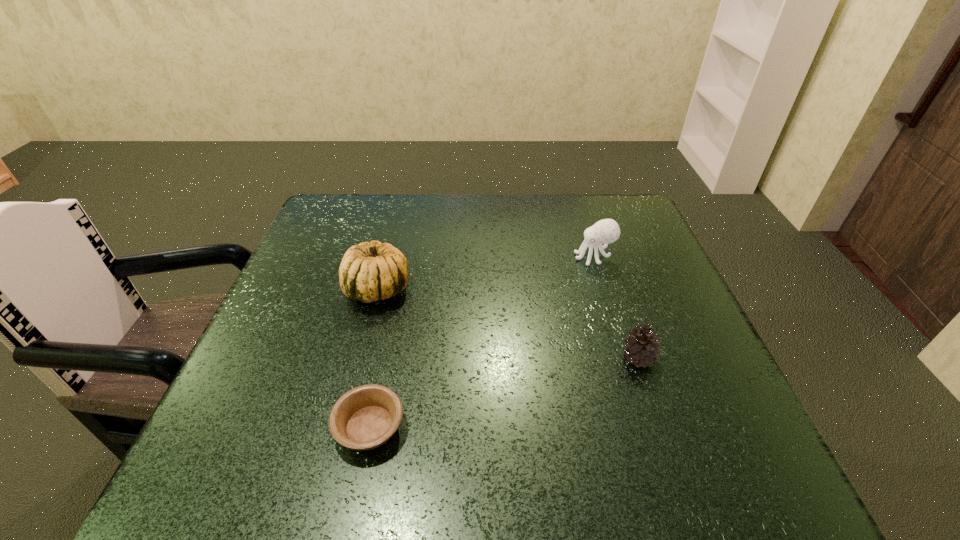
The height and width of the screenshot is (540, 960). In order to click on vacant space located 0.180m on the left of the second nearest object in this screenshot , I will do `click(530, 357)`.

Locate an element on the screen. Image resolution: width=960 pixels, height=540 pixels. vacant space located 0.200m on the back of the shortest object is located at coordinates (393, 318).

Identify the location of object that is at the near edge. The height and width of the screenshot is (540, 960). (365, 417).

I want to click on object present at the left edge, so click(x=369, y=272).

The height and width of the screenshot is (540, 960). Identify the location of octopus present at the right edge. (606, 231).

The image size is (960, 540). In order to click on pinecone situated at the right edge in this screenshot , I will do `click(643, 348)`.

Where is `vacant space at the far edge`? This screenshot has height=540, width=960. vacant space at the far edge is located at coordinates [x=400, y=197].

In the image, there is a desktop. At what (x,y) coordinates should I click in order to perform the action: click on vacant space at the near edge. Please return your answer as a coordinate pair (x, y). This screenshot has width=960, height=540. Looking at the image, I should click on (540, 463).

Image resolution: width=960 pixels, height=540 pixels. Identify the location of vacant region at the left edge of the desktop. (306, 321).

Find the location of `vacant space at the right edge of the desktop`. vacant space at the right edge of the desktop is located at coordinates (650, 280).